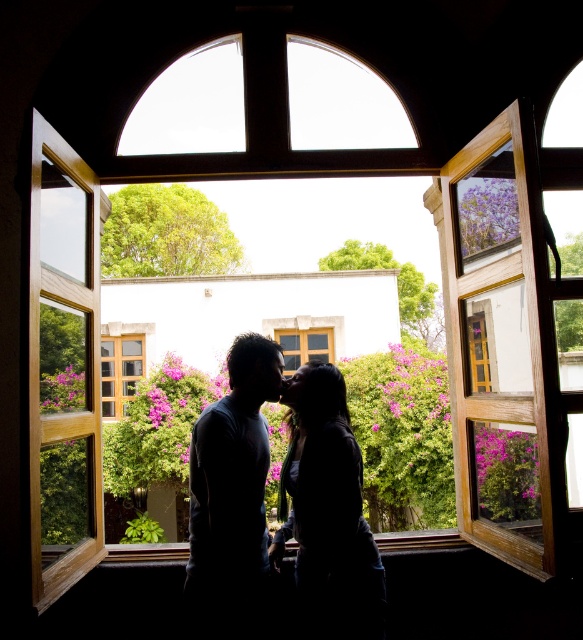
Between point (266, 573) and point (93, 492), which one is positioned behind?

The point (93, 492) is more distant.

Between black matte couple at center and wooden frame at left, which one has less height?

With less height is black matte couple at center.

Who is more forward, (331, 460) or (59, 257)?

Positioned in front is point (331, 460).

Locate an element on the screen. This screenshot has height=640, width=583. black matte couple at center is located at coordinates (234, 497).

Does wooden frame at left appear under wooden window at center?

Incorrect, wooden frame at left is not positioned below wooden window at center.

Measure the distance between point (x=82, y=492) and camera.

A distance of 3.28 meters exists between point (x=82, y=492) and camera.

Does point (57, 234) come behind point (100, 355)?

That is False.

At what (x,y) coordinates should I click in order to perform the action: click on wooden frame at left. Please return your answer as a coordinate pair (x, y). Looking at the image, I should click on (64, 365).

Which is behind, point (243, 349) or point (107, 372)?

The point (107, 372) is more distant.

Between black matte couple at center and wooden window at center, which one has less height?

black matte couple at center is shorter.

Identify the location of black matte couple at center. [x=234, y=497].